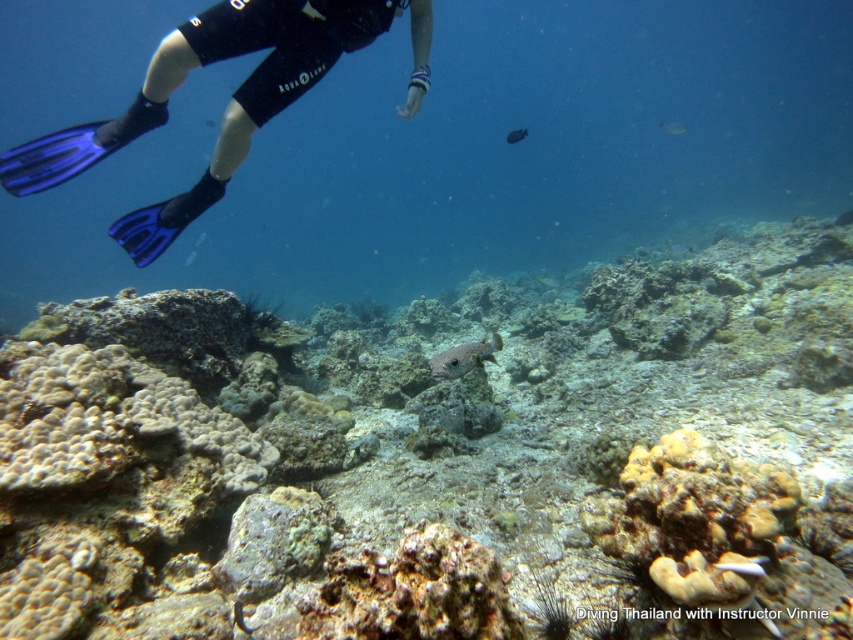
You are an underwater photographer aiming to capture a photo of the rough textured coral reef at center and the speckled gray fish at center. Based on their positions, which object should you focus on first to ensure both are in the frame?

The speckled gray fish at center should be focused on first since the rough textured coral reef at center is to the right of it, allowing you to adjust the frame to include both.

You are a marine biologist observing underwater life. You notice a white matte fish at center and a silvery metallic fish at center. Which fish is located below the other?

The white matte fish at center is positioned under the silvery metallic fish at center.